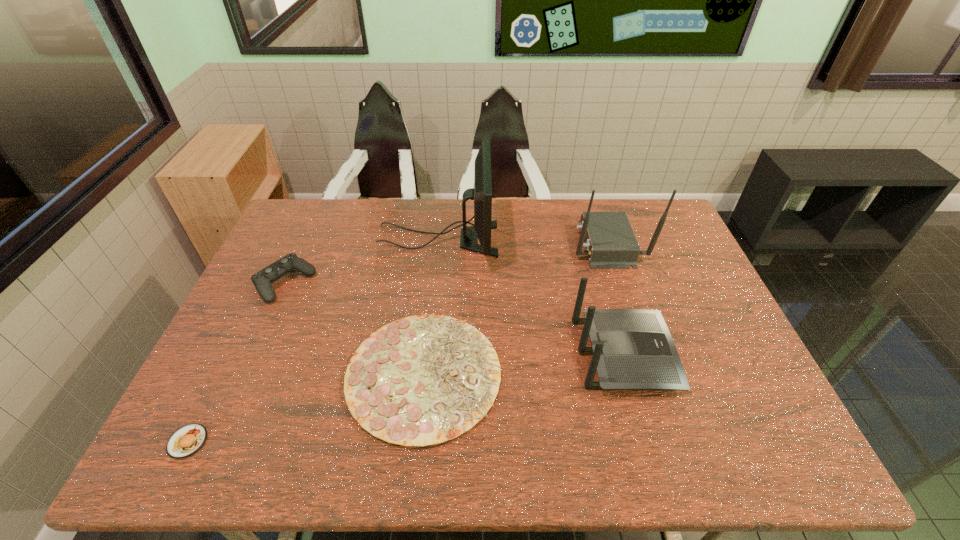
Find the location of a particular element. The image size is (960, 540). free space that satisfies the following two spatial constraints: 1. on the back of the taller router to connect cables; 2. on the front side of the fourth tallest object is located at coordinates (619, 283).

Find the location of `free spot that satisfies the following two spatial constraints: 1. on the screen side of the computer monitor; 2. on the right side of the pizza`. free spot that satisfies the following two spatial constraints: 1. on the screen side of the computer monitor; 2. on the right side of the pizza is located at coordinates (423, 374).

Where is `vacant area in the image that satisfies the following two spatial constraints: 1. on the front-facing side of the fourth shortest object; 2. on the screen side of the computer monitor`? The width and height of the screenshot is (960, 540). vacant area in the image that satisfies the following two spatial constraints: 1. on the front-facing side of the fourth shortest object; 2. on the screen side of the computer monitor is located at coordinates (591, 239).